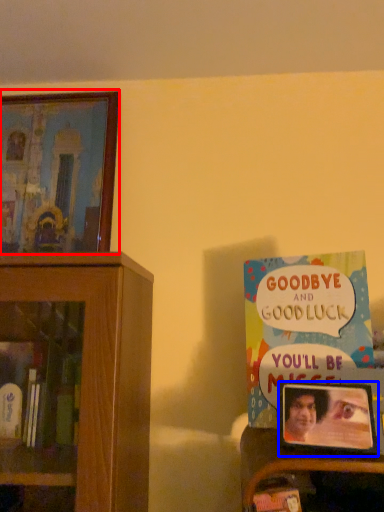
Question: Which object is closer to the camera taking this photo, picture frame (highlighted by a red box) or picture frame (highlighted by a blue box)?

Choices:
 (A) picture frame
 (B) picture frame

Answer: (B)